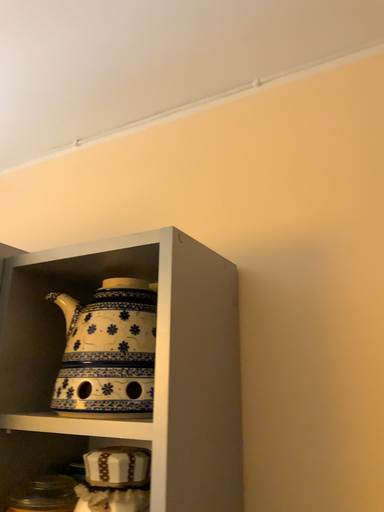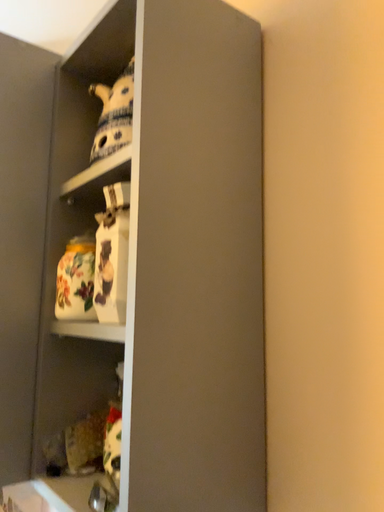
Question: Which way did the camera rotate in the video?

Choices:
 (A) rotated upward
 (B) rotated downward

Answer: (B)